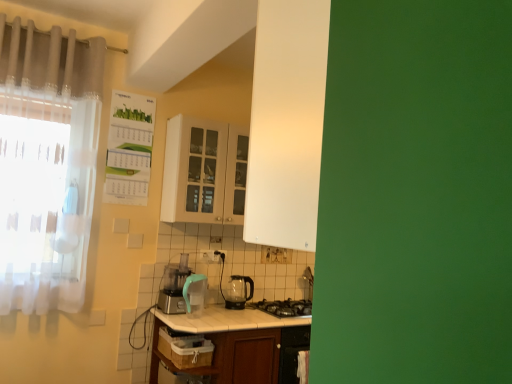
Question: Considering the relative positions of transparent glass kettle at center and translucent fabric curtain at upper left, the 2th curtain from the bottom, in the image provided, is transparent glass kettle at center to the left or to the right of translucent fabric curtain at upper left, the 2th curtain from the bottom,?

Choices:
 (A) right
 (B) left

Answer: (A)

Question: Choose the correct answer: Is transparent glass kettle at center inside translucent fabric curtain at upper left, marked as the first curtain in a top-to-bottom arrangement, or outside it?

Choices:
 (A) inside
 (B) outside

Answer: (B)

Question: Estimate the real-world distances between objects in this image. Which object is farther from the translucent fabric curtain at upper left, marked as the first curtain in a top-to-bottom arrangement?

Choices:
 (A) matte white cabinet at center
 (B) white glossy table at center
 (C) black glass gas stove at lower center
 (D) transparent glass kettle at center
 (E) black plastic electric outlet at center

Answer: (C)

Question: Based on their relative distances, which object is nearer to the white sheer curtain at left, which is the 2th curtain in top-to-bottom order?

Choices:
 (A) translucent fabric curtain at upper left, the 2th curtain from the bottom
 (B) transparent glass kettle at center
 (C) teal plastic pitcher at center
 (D) matte white cabinet at center
 (E) black plastic electric outlet at center

Answer: (A)